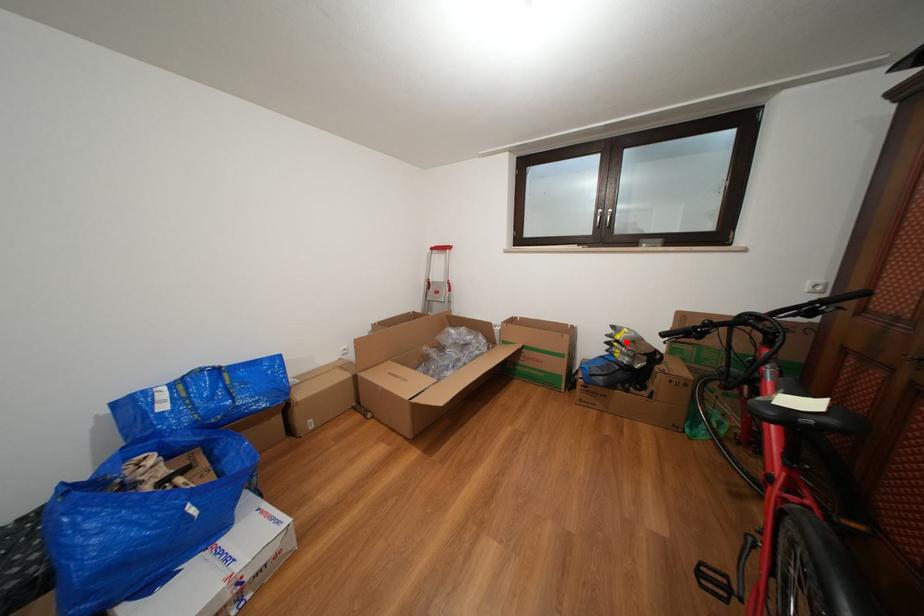
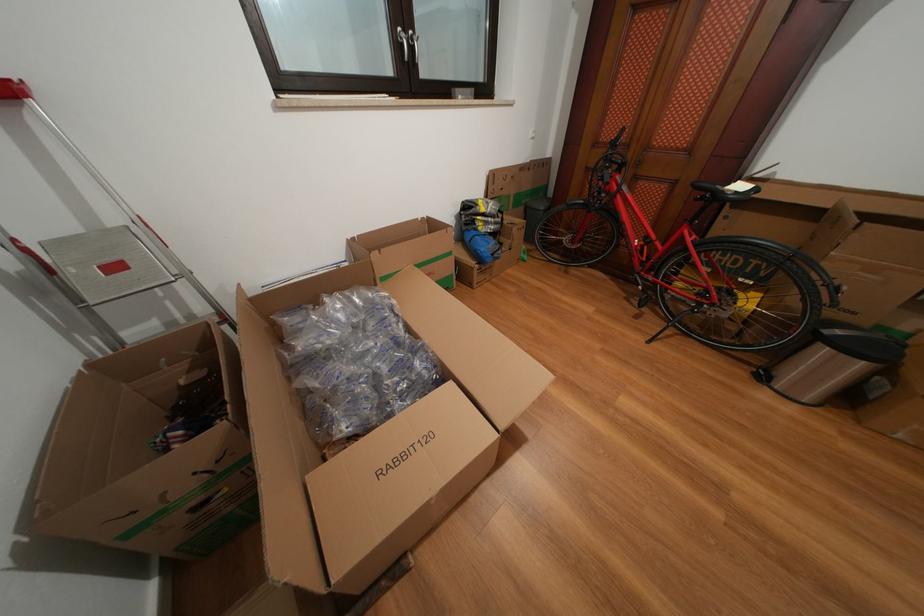
In the second image, find the point that corresponds to the highlighted location in the first image.

(491, 215)